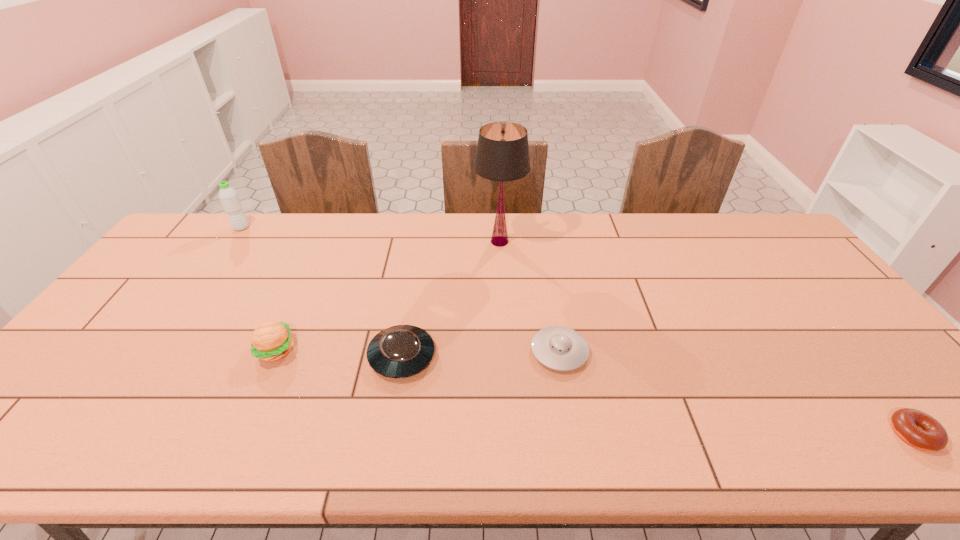
Where is `object located in the right edge section of the desktop`? This screenshot has height=540, width=960. object located in the right edge section of the desktop is located at coordinates (920, 430).

Where is `object at the near right corner`? The image size is (960, 540). object at the near right corner is located at coordinates (920, 430).

Where is `vacant region at the far edge`? The image size is (960, 540). vacant region at the far edge is located at coordinates (545, 227).

The image size is (960, 540). In the image, there is a desktop. Find the location of `vacant space at the near edge`. vacant space at the near edge is located at coordinates (371, 441).

Locate an element on the screen. vacant space at the left edge of the desktop is located at coordinates (76, 369).

Identify the location of free space at the right edge of the desktop. Image resolution: width=960 pixels, height=540 pixels. (818, 328).

At what (x,y) coordinates should I click in order to perform the action: click on vacant area at the far right corner of the desktop. Please return your answer as a coordinate pair (x, y). The width and height of the screenshot is (960, 540). Looking at the image, I should click on (733, 225).

Locate an element on the screen. This screenshot has width=960, height=540. free area in between the shorter saucer and the nearest object is located at coordinates (736, 393).

At what (x,y) coordinates should I click in order to perform the action: click on free point between the fifth tallest object and the taller saucer. Please return your answer as a coordinate pair (x, y). Looking at the image, I should click on (481, 354).

Find the location of a particular element. The height and width of the screenshot is (540, 960). unoccupied position between the shortest object and the second shortest object is located at coordinates (736, 393).